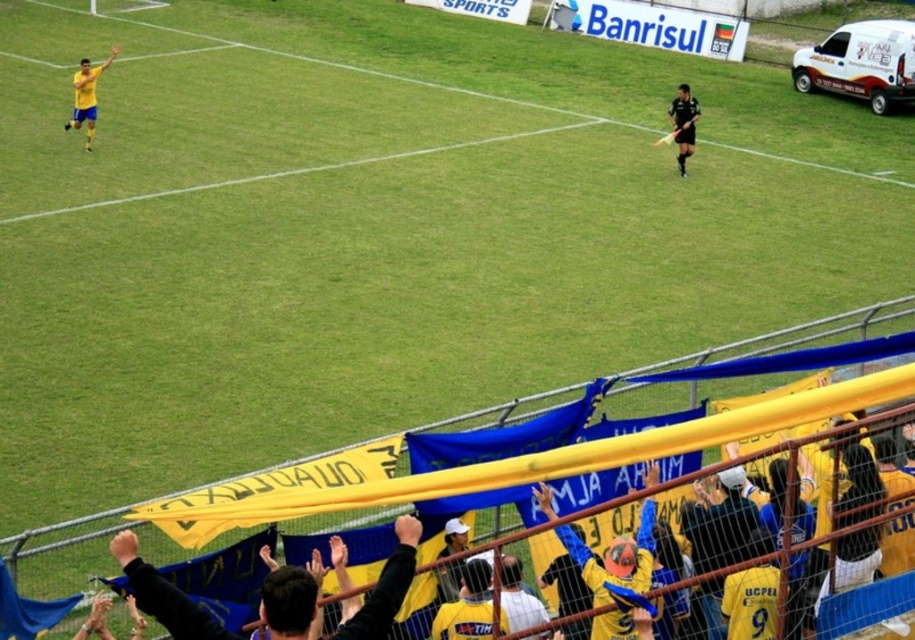
Consider the image. Who is positioned more to the left, matte yellow shorts at left or black matte uniform at center?

Positioned to the left is matte yellow shorts at left.

Does matte yellow shorts at left have a greater height compared to black matte uniform at center?

Indeed, matte yellow shorts at left has a greater height compared to black matte uniform at center.

Describe the element at coordinates (85, 96) in the screenshot. I see `matte yellow shorts at left` at that location.

I want to click on matte yellow shorts at left, so click(85, 96).